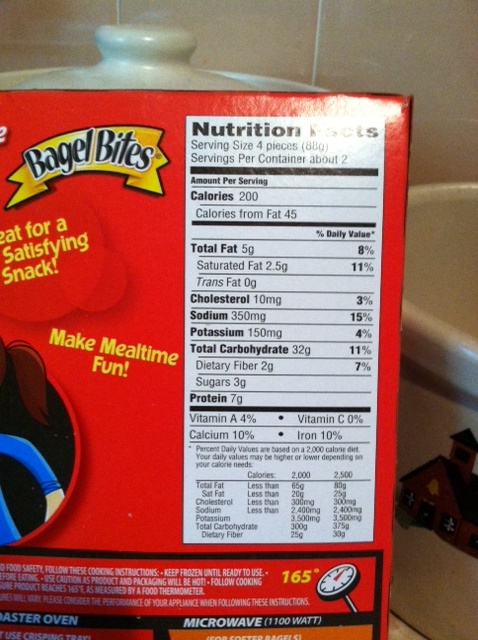
Locate an element on the screen. jar lids is located at coordinates (420, 214).